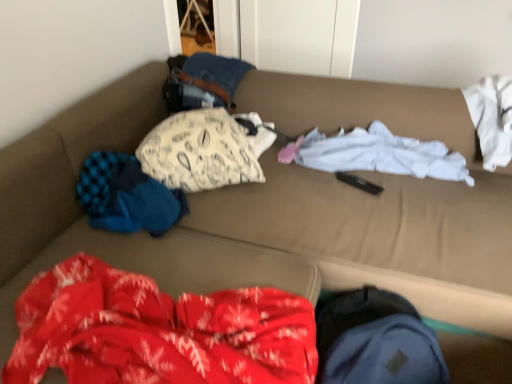
Question: Would you say white printed pillow at center, the second clothing from the right, is a long distance from blue knitted sweater at left, marked as the 1th clothing in a left-to-right arrangement?

Choices:
 (A) yes
 (B) no

Answer: (B)

Question: Does white printed pillow at center, the 2th clothing positioned from the left, appear on the right side of blue knitted sweater at left, marked as the 1th clothing in a left-to-right arrangement?

Choices:
 (A) yes
 (B) no

Answer: (A)

Question: Considering the relative sizes of white printed pillow at center, the second clothing from the right, and blue knitted sweater at left, marked as the 1th clothing in a left-to-right arrangement, in the image provided, is white printed pillow at center, the second clothing from the right, shorter than blue knitted sweater at left, marked as the 1th clothing in a left-to-right arrangement,?

Choices:
 (A) no
 (B) yes

Answer: (A)

Question: Is white printed pillow at center, the second clothing from the right, touching blue knitted sweater at left, marked as the 1th clothing in a left-to-right arrangement?

Choices:
 (A) no
 (B) yes

Answer: (A)

Question: From the image's perspective, is white printed pillow at center, the 2th clothing positioned from the left, over blue knitted sweater at left, marked as the 1th clothing in a left-to-right arrangement?

Choices:
 (A) yes
 (B) no

Answer: (A)

Question: Is point (82, 185) positioned closer to the camera than point (254, 170)?

Choices:
 (A) farther
 (B) closer

Answer: (B)

Question: Choose the correct answer: Is blue knitted sweater at left, the 3th clothing when ordered from right to left, inside white printed pillow at center, the 2th clothing positioned from the left, or outside it?

Choices:
 (A) inside
 (B) outside

Answer: (B)

Question: From a real-world perspective, is blue knitted sweater at left, the 3th clothing when ordered from right to left, positioned above or below white printed pillow at center, the second clothing from the right?

Choices:
 (A) below
 (B) above

Answer: (A)

Question: Is blue knitted sweater at left, marked as the 1th clothing in a left-to-right arrangement, taller or shorter than white printed pillow at center, the second clothing from the right?

Choices:
 (A) tall
 (B) short

Answer: (B)

Question: Would you say white printed pillow at center, the second clothing from the right, is to the left or to the right of white cotton shirt at center, which appears as the 3th clothing when viewed from the left, in the picture?

Choices:
 (A) left
 (B) right

Answer: (A)

Question: Considering the positions of white printed pillow at center, the 2th clothing positioned from the left, and white cotton shirt at center, the first clothing in the right-to-left sequence, in the image, is white printed pillow at center, the 2th clothing positioned from the left, taller or shorter than white cotton shirt at center, the first clothing in the right-to-left sequence,?

Choices:
 (A) short
 (B) tall

Answer: (B)

Question: Is white printed pillow at center, the 2th clothing positioned from the left, in front of or behind white cotton shirt at center, the first clothing in the right-to-left sequence, in the image?

Choices:
 (A) front
 (B) behind

Answer: (A)

Question: Looking at their shapes, would you say white printed pillow at center, the second clothing from the right, is wider or thinner than white cotton shirt at center, which appears as the 3th clothing when viewed from the left?

Choices:
 (A) wide
 (B) thin

Answer: (A)

Question: In terms of size, does white cotton shirt at center, which appears as the 3th clothing when viewed from the left, appear bigger or smaller than blue knitted sweater at left, marked as the 1th clothing in a left-to-right arrangement?

Choices:
 (A) small
 (B) big

Answer: (B)

Question: Considering the positions of white cotton shirt at center, the first clothing in the right-to-left sequence, and blue knitted sweater at left, the 3th clothing when ordered from right to left, in the image, is white cotton shirt at center, the first clothing in the right-to-left sequence, taller or shorter than blue knitted sweater at left, the 3th clothing when ordered from right to left,?

Choices:
 (A) tall
 (B) short

Answer: (B)